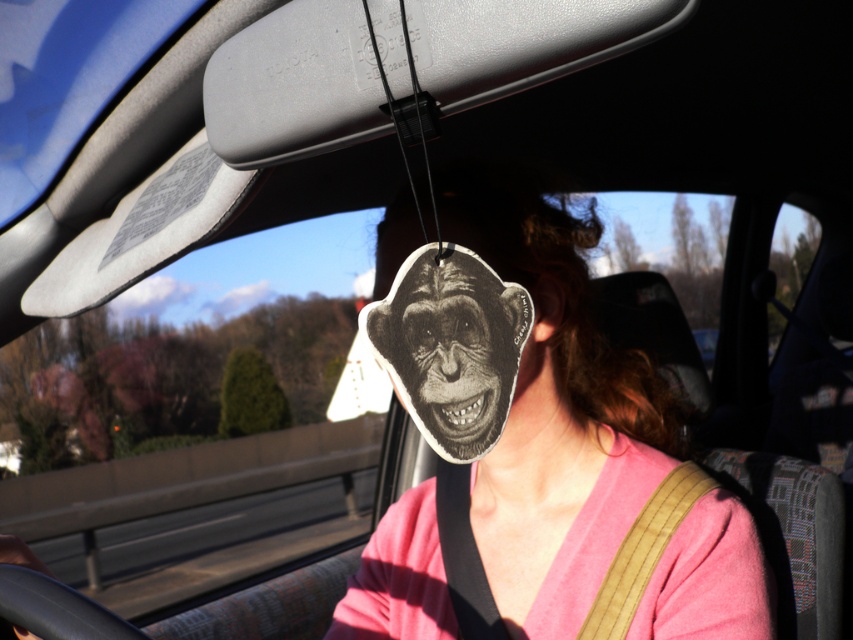
Does matte paper monkey face at center have a lesser height compared to black paper monkey face at center?

No, matte paper monkey face at center is not shorter than black paper monkey face at center.

From the picture: Can you confirm if matte paper monkey face at center is smaller than black paper monkey face at center?

Actually, matte paper monkey face at center might be larger than black paper monkey face at center.

The width and height of the screenshot is (853, 640). What do you see at coordinates (556, 420) in the screenshot?
I see `matte paper monkey face at center` at bounding box center [556, 420].

You are a GUI agent. You are given a task and a screenshot of the screen. Output one action in this format:
    pyautogui.click(x=<x>, y=<y>)
    Task: Click on the matte paper monkey face at center
    This screenshot has width=853, height=640.
    Given the screenshot: What is the action you would take?
    pyautogui.click(x=556, y=420)